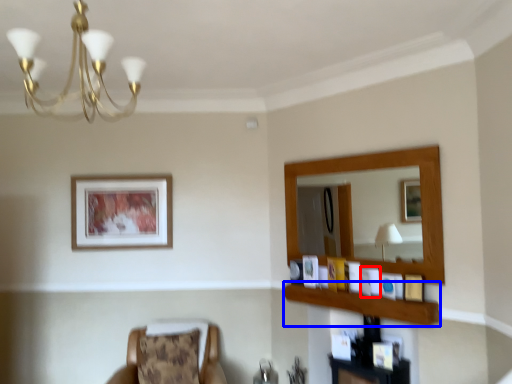
Question: Which object appears closest to the camera in this image, picture frame (highlighted by a red box) or balustrade (highlighted by a blue box)?

Choices:
 (A) picture frame
 (B) balustrade

Answer: (B)